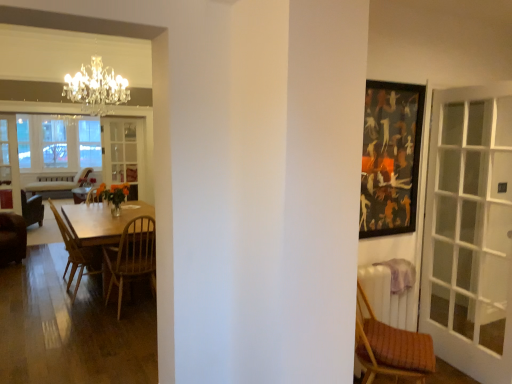
This screenshot has height=384, width=512. Identify the location of wooden textured chair at right, acting as the 4th chair starting from the left. (390, 347).

What do you see at coordinates (10, 158) in the screenshot? I see `clear glass screen door at left, acting as the 1th screen door starting from the left` at bounding box center [10, 158].

Identify the location of clear glass screen door at center, acting as the first screen door starting from the back. (124, 154).

This screenshot has height=384, width=512. Describe the element at coordinates (77, 254) in the screenshot. I see `wooden chair at left, positioned as the 2th chair in back-to-front order` at that location.

You are a GUI agent. You are given a task and a screenshot of the screen. Output one action in this format:
    pyautogui.click(x=<x>, y=<y>)
    Task: Click on the brown leather chair at left, the first chair when ordered from back to front
    
    Given the screenshot: What is the action you would take?
    pyautogui.click(x=12, y=238)

From a real-world perspective, which object stands above the other?

clear glass screen door at left, acting as the 1th screen door starting from the left.

From the image's perspective, count 3rd chairs downward from the clear glass screen door at left, which is the 1th screen door from front to back, and point to it. Please provide its 2D coordinates.

[(132, 257)]

From the image's perspective, is wooden at left, which appears as the 2th chair when viewed from the right, located above or below clear glass screen door at left, acting as the 1th screen door starting from the left?

wooden at left, which appears as the 2th chair when viewed from the right, is situated lower than clear glass screen door at left, acting as the 1th screen door starting from the left, in the image.

Is wooden table at left inside or outside of wooden textured chair at right, the first chair from the front?

wooden table at left lies outside wooden textured chair at right, the first chair from the front.

Is wooden table at left placed right next to wooden textured chair at right, the 1th chair positioned from the right?

wooden table at left and wooden textured chair at right, the 1th chair positioned from the right, are clearly separated.

From the image's perspective, is wooden table at left beneath wooden textured chair at right, the fourth chair when ordered from back to front?

No.

In terms of width, does wooden table at left look wider or thinner when compared to wooden textured chair at right, acting as the 4th chair starting from the left?

In the image, wooden table at left appears to be wider than wooden textured chair at right, acting as the 4th chair starting from the left.

Looking at the image, does dark wood picture frame at upper right seem bigger or smaller compared to clear glass screen door at center, placed as the 1th screen door when sorted from right to left?

Clearly, dark wood picture frame at upper right is smaller in size than clear glass screen door at center, placed as the 1th screen door when sorted from right to left.

In the scene shown: Can you confirm if dark wood picture frame at upper right is taller than clear glass screen door at center, the second screen door from the left?

Incorrect, the height of dark wood picture frame at upper right is not larger of that of clear glass screen door at center, the second screen door from the left.

Does point (405, 91) come in front of point (135, 170)?

Yes, point (405, 91) is in front of point (135, 170).

From a real-world perspective, count 1st screen doors downward from the dark wood picture frame at upper right and point to it. Please provide its 2D coordinates.

[(124, 154)]

Is wooden at left, which appears as the 2th chair when viewed from the right, positioned far away from wooden chair at left, positioned as the 2th chair in back-to-front order?

That's not correct — wooden at left, which appears as the 2th chair when viewed from the right, is a little close to wooden chair at left, positioned as the 2th chair in back-to-front order.

Considering the positions of point (128, 273) and point (75, 289), is point (128, 273) closer or farther from the camera than point (75, 289)?

Clearly, point (128, 273) is closer to the camera than point (75, 289).

From their relative heights in the image, would you say wooden at left, which is counted as the third chair, starting from the left, is taller or shorter than wooden chair at left, positioned as the 2th chair in back-to-front order?

Considering their sizes, wooden at left, which is counted as the third chair, starting from the left, has more height than wooden chair at left, positioned as the 2th chair in back-to-front order.

Locate an element on the screen. This screenshot has width=512, height=384. the 1st chair located above the wooden chair at left, which is counted as the third chair, starting from the right (from a real-world perspective) is located at coordinates (132, 257).

Considering the sizes of brown leather chair at left, the first chair when ordered from back to front, and wooden textured chair at right, the 1th chair positioned from the right, in the image, is brown leather chair at left, the first chair when ordered from back to front, wider or thinner than wooden textured chair at right, the 1th chair positioned from the right,?

brown leather chair at left, the first chair when ordered from back to front, is wider than wooden textured chair at right, the 1th chair positioned from the right.

Is point (9, 258) less distant than point (393, 373)?

No, (9, 258) is behind (393, 373).

How different are the orientations of brown leather chair at left, which is the fourth chair in front-to-back order, and wooden textured chair at right, acting as the 4th chair starting from the left, in degrees?

The angular difference between brown leather chair at left, which is the fourth chair in front-to-back order, and wooden textured chair at right, acting as the 4th chair starting from the left, is 3.85 degrees.

Which of these two, brown leather chair at left, acting as the first chair starting from the left, or wooden textured chair at right, the 1th chair positioned from the right, stands taller?

With more height is wooden textured chair at right, the 1th chair positioned from the right.

Based on the photo, between clear glass screen door at left, marked as the 2th screen door in a right-to-left arrangement, and clear glass screen door at center, placed as the 1th screen door when sorted from right to left, which one is positioned behind?

clear glass screen door at center, placed as the 1th screen door when sorted from right to left, is more distant.

Looking at this image, does clear glass screen door at left, the second screen door from the back, have a larger size compared to clear glass screen door at center, acting as the first screen door starting from the back?

Actually, clear glass screen door at left, the second screen door from the back, might be smaller than clear glass screen door at center, acting as the first screen door starting from the back.

Based on their positions, is clear glass screen door at left, the second screen door from the back, located to the left or right of clear glass screen door at center, placed as the 1th screen door when sorted from right to left?

clear glass screen door at left, the second screen door from the back, is to the left of clear glass screen door at center, placed as the 1th screen door when sorted from right to left.

Between clear glass screen door at left, acting as the 1th screen door starting from the left, and clear glass screen door at center, the second screen door from the left, which one has larger width?

With larger width is clear glass screen door at center, the second screen door from the left.

From the image's perspective, which object appears higher, wooden at left, which is counted as the third chair, starting from the left, or wooden textured chair at right, the first chair from the front?

wooden at left, which is counted as the third chair, starting from the left, from the image's perspective.

In the image, is wooden at left, which appears as the 2th chair when viewed from the right, positioned in front of or behind wooden textured chair at right, acting as the 4th chair starting from the left?

Clearly, wooden at left, which appears as the 2th chair when viewed from the right, is behind wooden textured chair at right, acting as the 4th chair starting from the left.

From a real-world perspective, which object stands above the other?

In real-world perspective, wooden textured chair at right, the 1th chair positioned from the right, is above.

Where is `the 3rd chair below the clear glass screen door at left, acting as the 1th screen door starting from the left (from the image's perspective)`? The height and width of the screenshot is (384, 512). the 3rd chair below the clear glass screen door at left, acting as the 1th screen door starting from the left (from the image's perspective) is located at coordinates (132, 257).

Locate an element on the screen. The image size is (512, 384). kitchen & dining room table located underneath the wooden textured chair at right, acting as the 4th chair starting from the left (from a real-world perspective) is located at coordinates (101, 221).

Considering their positions, is wooden textured chair at right, the 1th chair positioned from the right, positioned further to clear glass screen door at left, the second screen door from the back, than wooden table at left?

Based on the image, wooden textured chair at right, the 1th chair positioned from the right, appears to be further to clear glass screen door at left, the second screen door from the back.

From the picture: Looking at the image, which one is located closer to brown leather chair at left, acting as the first chair starting from the left, wooden at left, which ranks as the second chair in front-to-back order, or wooden textured chair at right, the first chair from the front?

wooden at left, which ranks as the second chair in front-to-back order, is closer to brown leather chair at left, acting as the first chair starting from the left.

When comparing their distances from brown leather chair at left, the first chair when ordered from back to front, does clear glass screen door at left, which is the 1th screen door from front to back, or wooden chair at left, the 2th chair in the left-to-right sequence, seem further?

The object further to brown leather chair at left, the first chair when ordered from back to front, is wooden chair at left, the 2th chair in the left-to-right sequence.

Estimate the real-world distances between objects in this image. Which object is closer to wooden textured chair at right, the fourth chair when ordered from back to front, brown leather chair at left, which is the fourth chair in front-to-back order, or dark wood picture frame at upper right?

dark wood picture frame at upper right.

Considering their positions, is clear glass screen door at center, the second screen door from the left, positioned further to clear glass screen door at left, the second screen door from the back, than wooden textured chair at right, the 1th chair positioned from the right?

wooden textured chair at right, the 1th chair positioned from the right.

Looking at the image, which one is located further to brown leather chair at left, which is the fourth chair in front-to-back order, wooden at left, which appears as the 2th chair when viewed from the right, or wooden chair at left, which is the third chair from front to back?

The object further to brown leather chair at left, which is the fourth chair in front-to-back order, is wooden at left, which appears as the 2th chair when viewed from the right.

Considering their positions, is wooden table at left positioned closer to clear glass screen door at left, the second screen door from the back, than wooden chair at left, which is counted as the third chair, starting from the right?

wooden chair at left, which is counted as the third chair, starting from the right, lies closer to clear glass screen door at left, the second screen door from the back, than the other object.

Considering their positions, is clear glass screen door at center, acting as the first screen door starting from the back, positioned closer to wooden at left, which appears as the 2th chair when viewed from the right, than brown leather chair at left, acting as the first chair starting from the left?

Among the two, clear glass screen door at center, acting as the first screen door starting from the back, is located nearer to wooden at left, which appears as the 2th chair when viewed from the right.

What are the coordinates of `picture frame located between wooden textured chair at right, the first chair from the front, and clear glass screen door at center, the 2th screen door viewed from the front, in the depth direction` in the screenshot? It's located at (390, 158).

The height and width of the screenshot is (384, 512). In order to click on kitchen & dining room table situated between brown leather chair at left, which is the fourth chair in front-to-back order, and wooden textured chair at right, the fourth chair when ordered from back to front, from left to right in this screenshot , I will do `click(101, 221)`.

What are the coordinates of `kitchen & dining room table located between wooden textured chair at right, the 1th chair positioned from the right, and clear glass screen door at center, the 2th screen door viewed from the front, in the depth direction` in the screenshot? It's located at (101, 221).

At what (x,y) coordinates should I click in order to perform the action: click on screen door between wooden at left, which ranks as the second chair in front-to-back order, and clear glass screen door at center, acting as the first screen door starting from the back, from front to back. Please return your answer as a coordinate pair (x, y). The width and height of the screenshot is (512, 384). Looking at the image, I should click on (10, 158).